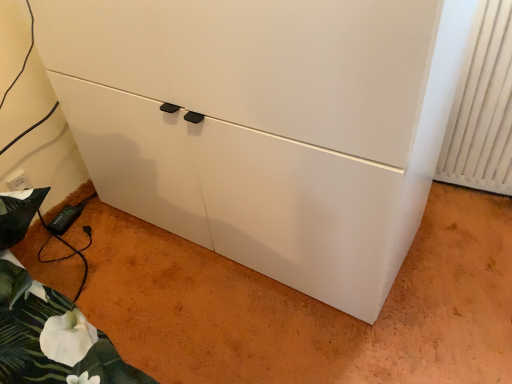
Find the location of `space that is in front of white matte cabinet at center`. space that is in front of white matte cabinet at center is located at coordinates (255, 326).